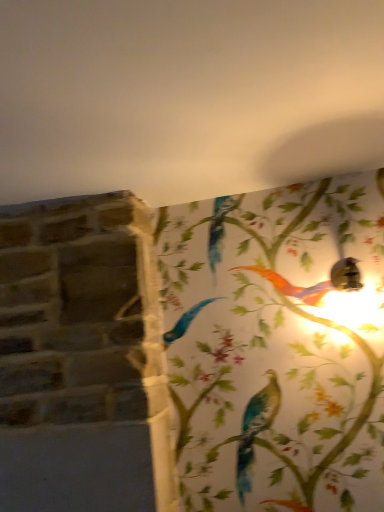
Describe the element at coordinates (346, 275) in the screenshot. Image resolution: width=384 pixels, height=512 pixels. I see `green matte parrot at upper right` at that location.

You are a GUI agent. You are given a task and a screenshot of the screen. Output one action in this format:
    pyautogui.click(x=<x>, y=<y>)
    Task: Click on the green matte parrot at upper right
    The width and height of the screenshot is (384, 512).
    Given the screenshot: What is the action you would take?
    pyautogui.click(x=346, y=275)

At what (x,y) coordinates should I click in order to perform the action: click on green matte parrot at upper right. Please return your answer as a coordinate pair (x, y). Looking at the image, I should click on (346, 275).